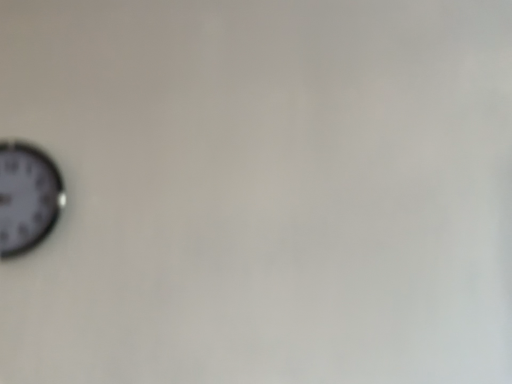
This screenshot has width=512, height=384. I want to click on matte black clock at left, so click(27, 197).

What do you see at coordinates (27, 197) in the screenshot? The image size is (512, 384). I see `matte black clock at left` at bounding box center [27, 197].

You are a GUI agent. You are given a task and a screenshot of the screen. Output one action in this format:
    pyautogui.click(x=<x>, y=<y>)
    Task: Click on the matte black clock at left
    Image resolution: width=512 pixels, height=384 pixels.
    Given the screenshot: What is the action you would take?
    pyautogui.click(x=27, y=197)